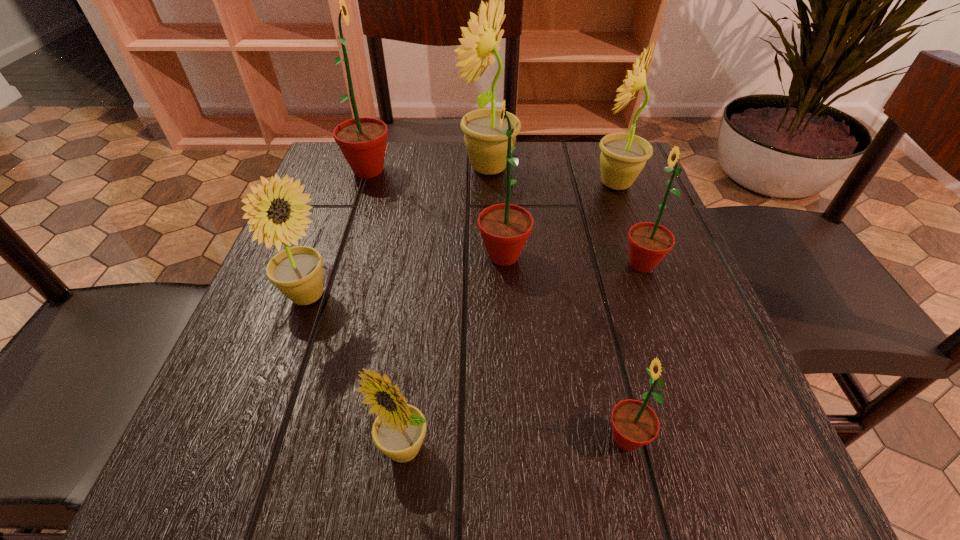
Select which object appears as the sixth closest to the smallest yellow sunflower. Please provide its 2D coordinates. Your answer should be formatted as a tuple, i.e. [(x, y)], where the tuple contains the x and y coordinates of a point satisfying the conditions above.

[(362, 141)]

This screenshot has height=540, width=960. Identify the location of object that can be found as the second closest to the rightmost green sunflower. (505, 228).

Where is `sunflower that stands as the third closest to the third green sunflower from right to left`? This screenshot has width=960, height=540. sunflower that stands as the third closest to the third green sunflower from right to left is located at coordinates (623, 156).

Identify which sunflower is the second closest to the farthest green sunflower. Please provide its 2D coordinates. Your answer should be formatted as a tuple, i.e. [(x, y)], where the tuple contains the x and y coordinates of a point satisfying the conditions above.

[(505, 228)]

This screenshot has width=960, height=540. In order to click on yellow sunflower that is the second closest to the rightmost green sunflower in this screenshot , I will do `click(487, 148)`.

Identify which yellow sunflower is the second closest to the second yellow sunflower from right to left. Please provide its 2D coordinates. Your answer should be formatted as a tuple, i.e. [(x, y)], where the tuple contains the x and y coordinates of a point satisfying the conditions above.

[(297, 272)]

Identify which green sunflower is located as the third nearest to the second biggest yellow sunflower. Please provide its 2D coordinates. Your answer should be formatted as a tuple, i.e. [(x, y)], where the tuple contains the x and y coordinates of a point satisfying the conditions above.

[(362, 141)]

Point out which green sunflower is positioned as the nearest to the farthest green sunflower. Please provide its 2D coordinates. Your answer should be formatted as a tuple, i.e. [(x, y)], where the tuple contains the x and y coordinates of a point satisfying the conditions above.

[(505, 228)]